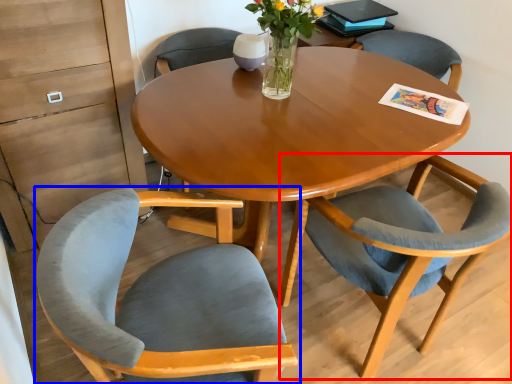
Question: Which object appears farthest to the camera in this image, chair (highlighted by a red box) or chair (highlighted by a blue box)?

Choices:
 (A) chair
 (B) chair

Answer: (A)